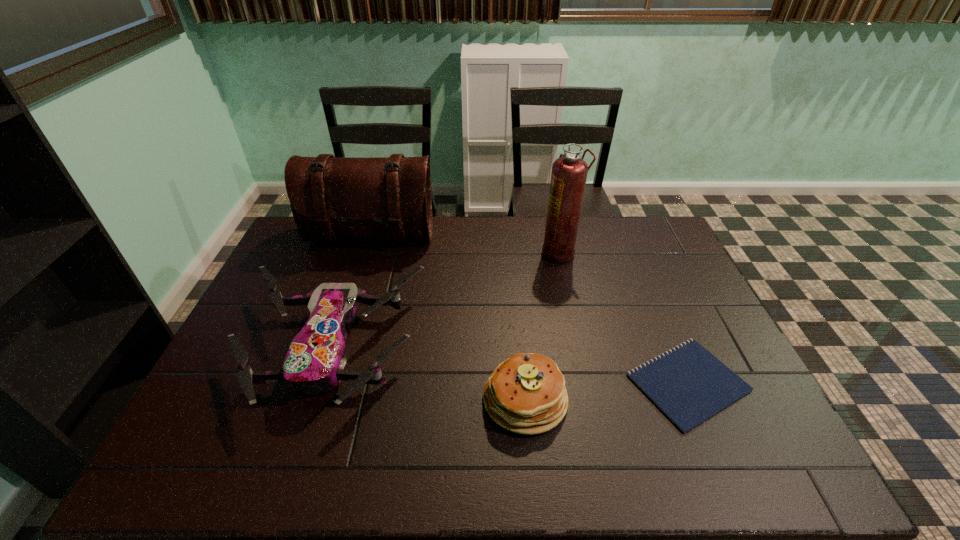
Where is `vacant area between the satchel and the fire extinguisher`? The height and width of the screenshot is (540, 960). vacant area between the satchel and the fire extinguisher is located at coordinates (466, 245).

Locate an element on the screen. object that ranks as the fourth closest to the satchel is located at coordinates (688, 384).

Locate which object ranks fourth in proximity to the pancake. Please provide its 2D coordinates. Your answer should be formatted as a tuple, i.e. [(x, y)], where the tuple contains the x and y coordinates of a point satisfying the conditions above.

[(332, 198)]

Find the location of a particular element. Image resolution: width=960 pixels, height=540 pixels. vacant area in the image that satisfies the following two spatial constraints: 1. on the back side of the rightmost object; 2. on the side of the fire extinguisher with the label is located at coordinates (633, 253).

You are a GUI agent. You are given a task and a screenshot of the screen. Output one action in this format:
    pyautogui.click(x=<x>, y=<y>)
    Task: Click on the free point that satisfies the following two spatial constraints: 1. on the front-facing side of the fourth shortest object; 2. on the left side of the pancake
    
    Given the screenshot: What is the action you would take?
    pyautogui.click(x=321, y=399)

Image resolution: width=960 pixels, height=540 pixels. In order to click on vacant point that satisfies the following two spatial constraints: 1. on the front-facing side of the pancake; 2. on the right side of the drone in this screenshot , I will do `click(314, 399)`.